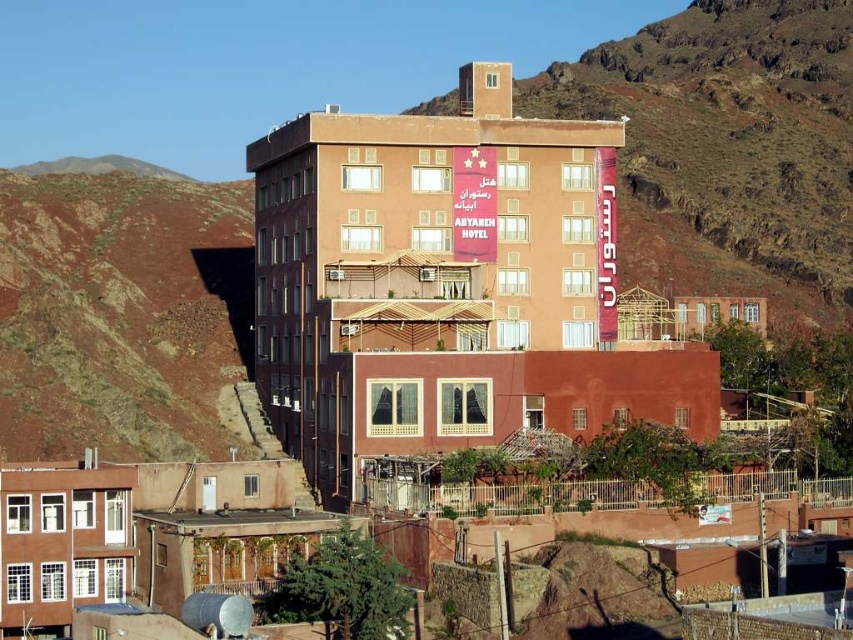
Question: Considering the real-world distances, which object is closest to the matte orange building at center?

Choices:
 (A) rustic clay hillside at left
 (B) orange clay building at center

Answer: (A)

Question: Does orange clay building at center lie behind rustic clay hillside at left?

Choices:
 (A) yes
 (B) no

Answer: (A)

Question: Which is farther from the rustic clay hillside at left?

Choices:
 (A) matte orange building at center
 (B) orange clay building at center

Answer: (B)

Question: Considering the relative positions of orange clay building at center and rustic clay hillside at left in the image provided, where is orange clay building at center located with respect to rustic clay hillside at left?

Choices:
 (A) left
 (B) right

Answer: (B)

Question: Does matte orange building at center lie behind orange clay building at center?

Choices:
 (A) yes
 (B) no

Answer: (B)

Question: Among these objects, which one is farthest from the camera?

Choices:
 (A) matte orange building at center
 (B) rustic clay hillside at left
 (C) orange clay building at center

Answer: (C)